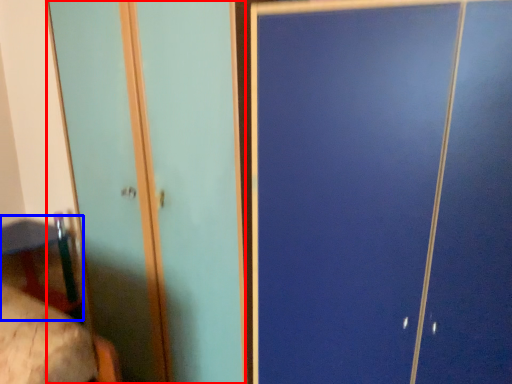
Question: Which of the following is the farthest to the observer, screen door (highlighted by a red box) or table (highlighted by a blue box)?

Choices:
 (A) screen door
 (B) table

Answer: (B)